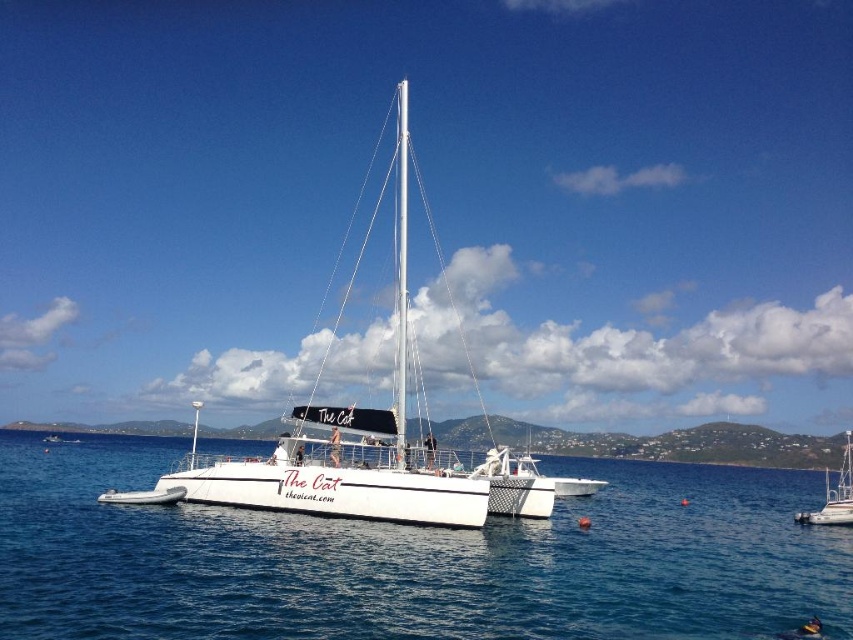
You are a photographer standing on the deck of The Cat. You want to take a photo that includes both the white water at center and the white matte sailboat at lower right. Which object will appear larger in the photo?

The white water at center will appear larger in the photo because it is closer to the viewer than the white matte sailboat at lower right.

You are planning to take a photo of the white water at center and the white matte sailboat at lower right. Which object is wider in the image?

The white matte sailboat at lower right is wider than the white water at center.